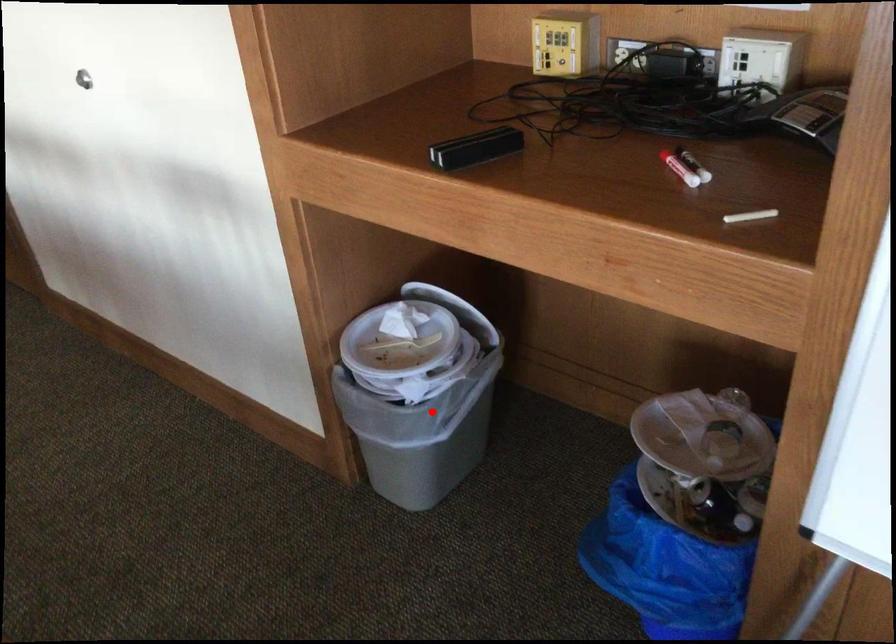
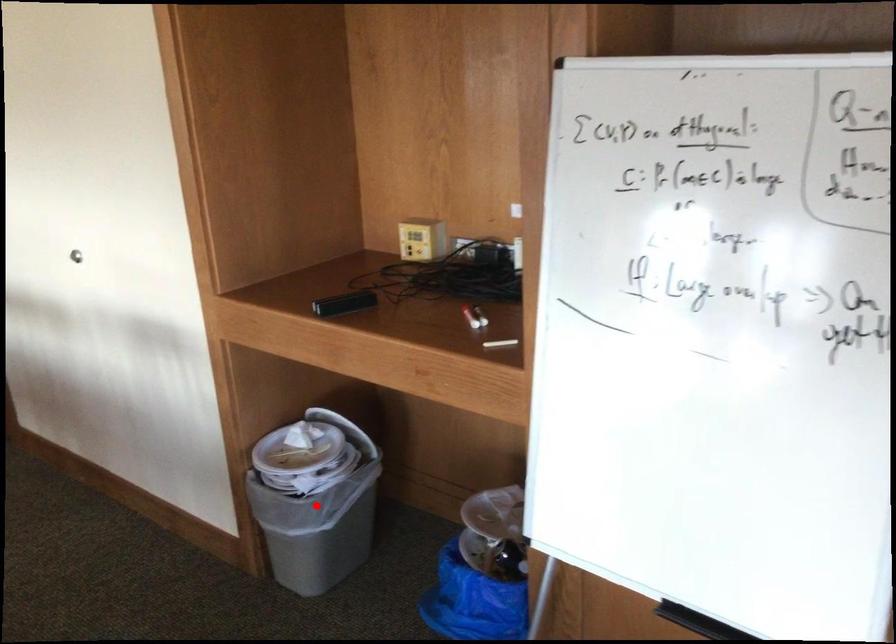
I am providing you with two images of the same scene from different viewpoints. A red point is marked on the first image and another point is marked on the second image. Does the point marked in image1 correspond to the same location as the one in image2?

Yes